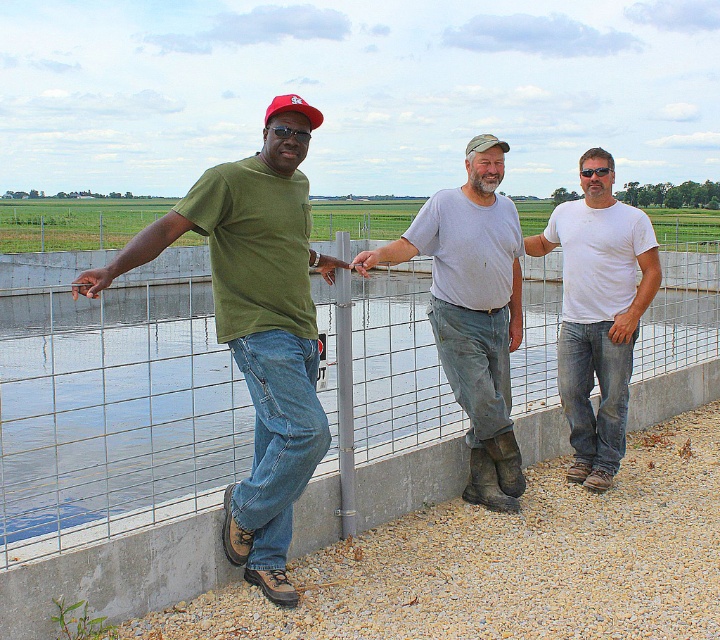
Based on the photo, you are navigating a small boat on a lake and see the image. The boat is currently at the point marked by the coordinates point (112,413). Which direction should you steer to avoid hitting the concrete structure with the wire fence?

The point (112,413) indicates clear water at center, so steering towards the center area would keep the boat away from the concrete structure with the wire fence.